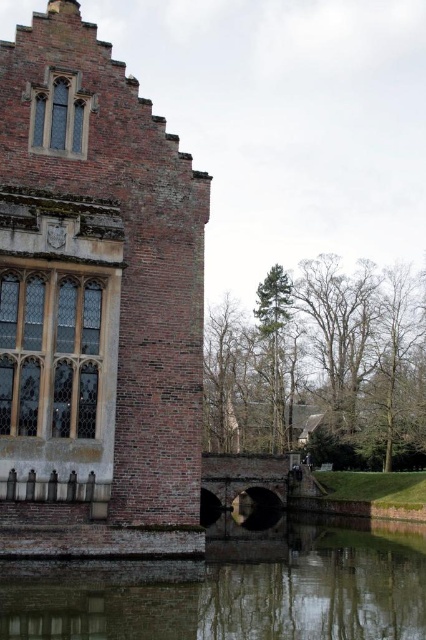
You are an architect examining the historic brick building. You notice the brick wall at left and the smooth reflective water at lower center. Which object occupies a larger area in the image?

The smooth reflective water at lower center occupies a larger area in the image compared to the brick wall at left.

You are standing in front of the historic brick building. You notice the brick wall at left and the smooth reflective water at lower center. Which object is positioned higher from the ground?

The brick wall at left is positioned higher from the ground than the smooth reflective water at lower center because the brick wall at left is above smooth reflective water at lower center.

From the picture: You are a maintenance worker needing to cross from the brick wall at left to the smooth reflective water at lower center. The bridge you have can only span 50 feet. Will it be sufficient?

The distance between the brick wall at left and the smooth reflective water at lower center is 55.72 feet, so the bridge spanning 50 feet is insufficient. You need a longer bridge to cover the gap.